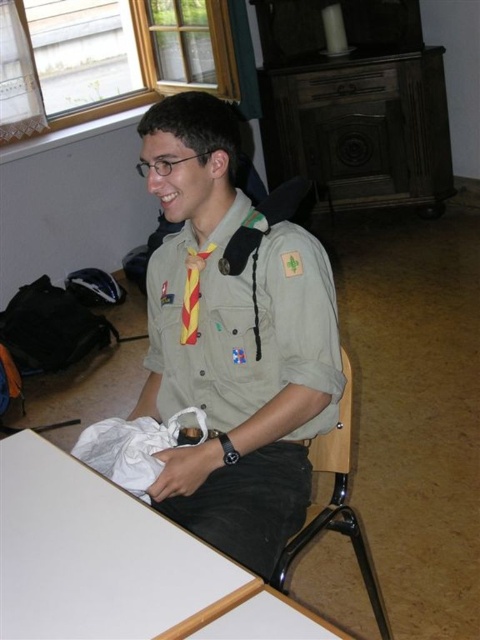
In the scene shown: Between white matte table at lower left and metallic black chair at lower right, which one appears on the left side from the viewer's perspective?

From the viewer's perspective, white matte table at lower left appears more on the left side.

Is white matte table at lower left closer to the viewer compared to metallic black chair at lower right?

Yes.

The width and height of the screenshot is (480, 640). Describe the element at coordinates (98, 556) in the screenshot. I see `white matte table at lower left` at that location.

Where is `white matte table at lower left`? The height and width of the screenshot is (640, 480). white matte table at lower left is located at coordinates (98, 556).

Which is in front, point (224, 301) or point (169, 563)?

Point (169, 563) is more forward.

Describe the element at coordinates (247, 378) in the screenshot. This screenshot has width=480, height=640. I see `khaki fabric uniform at center` at that location.

Is point (314, 412) positioned before point (6, 456)?

No, it is behind (6, 456).

This screenshot has height=640, width=480. In order to click on khaki fabric uniform at center in this screenshot , I will do `click(247, 378)`.

Looking at this image, which of these two, khaki fabric uniform at center or metallic black chair at lower right, stands taller?

With more height is khaki fabric uniform at center.

The height and width of the screenshot is (640, 480). What do you see at coordinates (247, 378) in the screenshot? I see `khaki fabric uniform at center` at bounding box center [247, 378].

Is point (312, 362) less distant than point (315, 536)?

Yes, point (312, 362) is closer to viewer.

Locate an element on the screen. khaki fabric uniform at center is located at coordinates point(247,378).